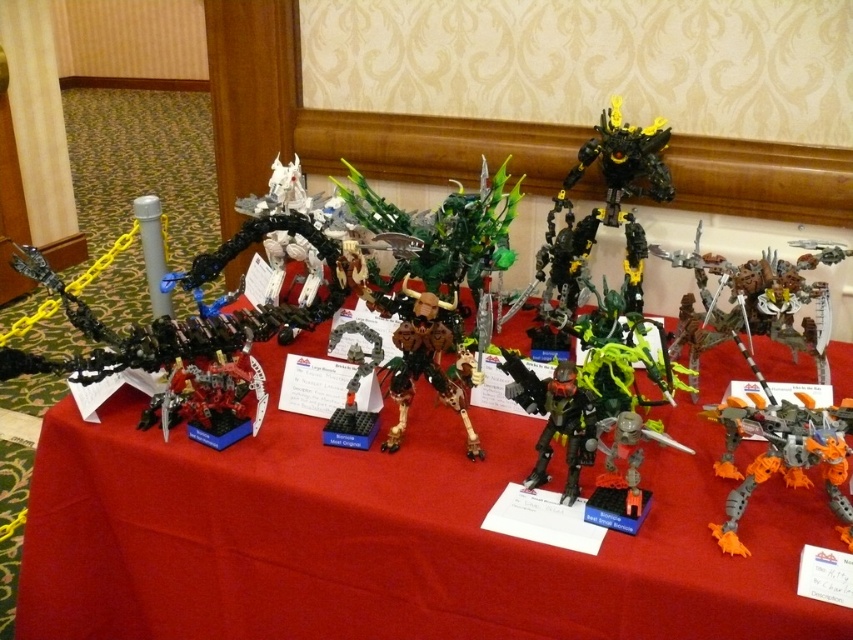
You are a guest at a LEGO exhibition and notice the orange matte robot at lower right and the shiny black armor at center. Which object is located below the other?

The orange matte robot at lower right is positioned under the shiny black armor at center, so the orange matte robot is below the shiny black armor.

You are a photographer setting up a shot of the red fabric tablecloth at center and the shiny black armor at center. You need to position your camera so that both objects are in focus. Given that your camera has a depth of field that can cover 12 inches, will you be able to capture both objects sharply without adjusting your focus?

The red fabric tablecloth at center is 12.33 inches away from the shiny black armor at center. Since the distance between them exceeds the camera s 12 inch depth of field, adjusting focus would be necessary to ensure both are in sharp focus.